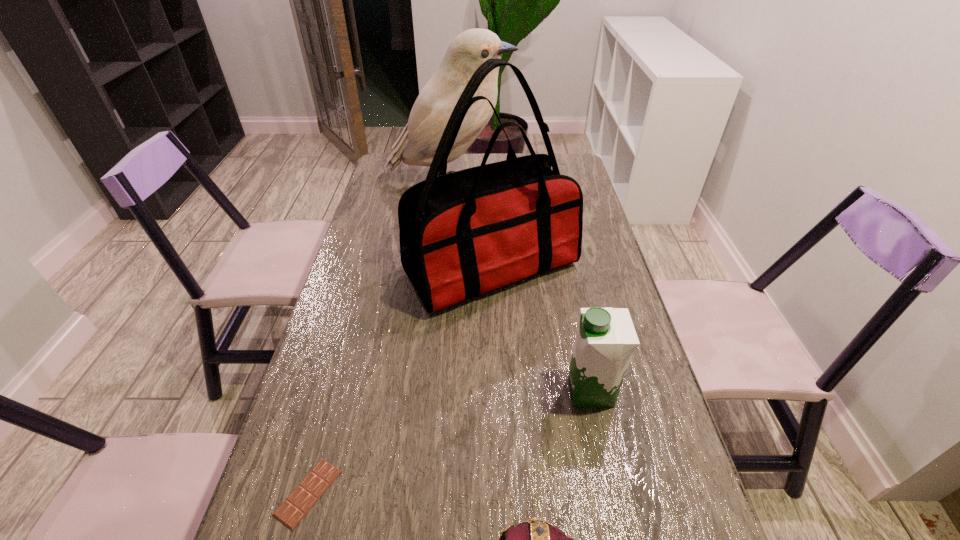
Where is `duffel bag`? The height and width of the screenshot is (540, 960). duffel bag is located at coordinates (461, 234).

Locate an element on the screen. The width and height of the screenshot is (960, 540). parakeet is located at coordinates (417, 144).

Locate an element on the screen. soya milk is located at coordinates (606, 338).

This screenshot has height=540, width=960. Identify the location of the third nearest object. (606, 338).

The image size is (960, 540). I want to click on the shortest object, so click(294, 508).

Find the location of a particular element. The image size is (960, 540). free point located 0.070m on the left of the duffel bag is located at coordinates (379, 269).

The width and height of the screenshot is (960, 540). What are the coordinates of `vacant space located 0.240m on the face of the farthest object` in the screenshot? It's located at (575, 183).

Where is `vacant space located 0.220m on the front-facing side of the third shortest object`? vacant space located 0.220m on the front-facing side of the third shortest object is located at coordinates (468, 391).

Locate an element on the screen. This screenshot has width=960, height=540. free space located on the front-facing side of the third shortest object is located at coordinates (504, 391).

Where is `free spot located on the front-facing side of the third shortest object`? free spot located on the front-facing side of the third shortest object is located at coordinates (420, 391).